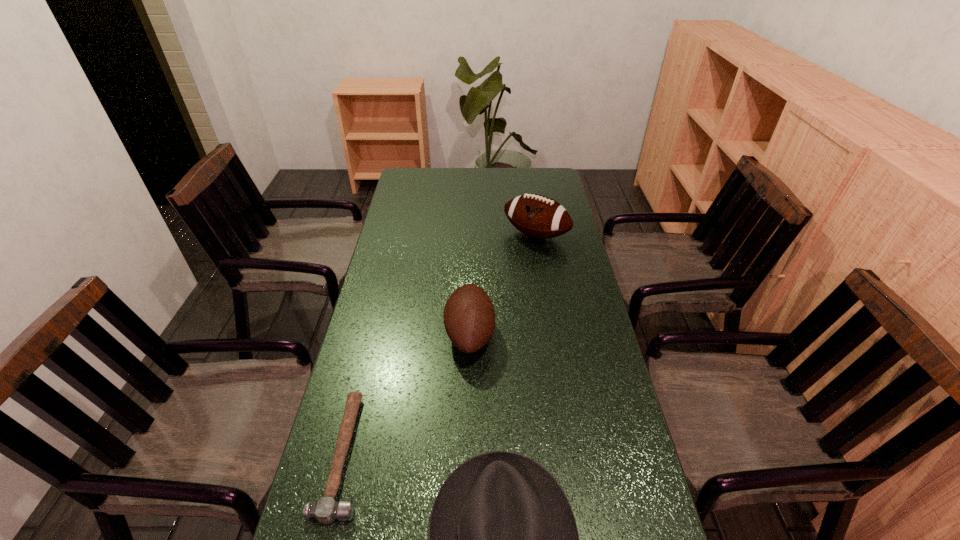
Locate an element on the screen. This screenshot has width=960, height=540. object located at the right edge is located at coordinates (538, 216).

Identify the location of free space at the left edge of the desktop. (362, 387).

Find the location of a particular element. vacant space at the right edge of the desktop is located at coordinates (581, 251).

At what (x,y) coordinates should I click in order to perform the action: click on free location at the far left corner of the desktop. Please return your answer as a coordinate pair (x, y). Image resolution: width=960 pixels, height=540 pixels. Looking at the image, I should click on (433, 170).

Find the location of a particular element. The width and height of the screenshot is (960, 540). free space between the nearer football and the hammer is located at coordinates (407, 394).

Locate an element on the screen. This screenshot has height=540, width=960. free spot between the farthest object and the leftmost object is located at coordinates 440,345.

Identify the location of blank region between the nearer football and the right football. The width and height of the screenshot is (960, 540). (503, 285).

Locate an element on the screen. unoccupied area between the right football and the nearer football is located at coordinates point(503,285).

You are a GUI agent. You are given a task and a screenshot of the screen. Output one action in this format:
    pyautogui.click(x=<x>, y=<y>)
    Task: Click on the vacant space in between the leftmost object and the farthest object
    The image size is (960, 540).
    Given the screenshot: What is the action you would take?
    pyautogui.click(x=440, y=345)

Where is `free space between the leftmost object and the second farthest object`? The width and height of the screenshot is (960, 540). free space between the leftmost object and the second farthest object is located at coordinates 407,394.